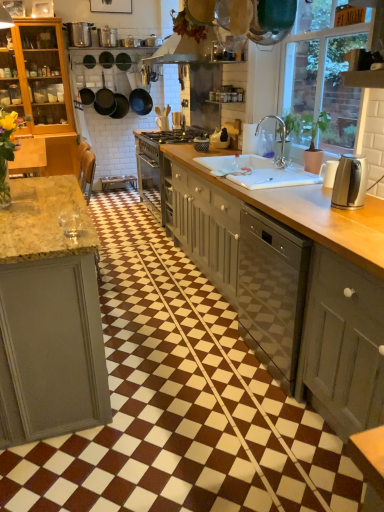
Question: Is matte black basket at center, which is the 2th appliance in front-to-back order, further to camera compared to satin silver toaster at center, which ranks as the fourth appliance in bottom-to-top order?

Choices:
 (A) no
 (B) yes

Answer: (A)

Question: Is matte black basket at center, which is the 4th appliance in back-to-front order, thinner than satin silver toaster at center, the first appliance in the back-to-front sequence?

Choices:
 (A) no
 (B) yes

Answer: (A)

Question: From the image's perspective, does matte black basket at center, which is the 4th appliance in back-to-front order, appear lower than satin silver toaster at center, the 4th appliance when ordered from right to left?

Choices:
 (A) no
 (B) yes

Answer: (B)

Question: Would you say satin silver toaster at center, the 4th appliance when ordered from right to left, is part of matte black basket at center, acting as the fourth appliance starting from the top,'s contents?

Choices:
 (A) no
 (B) yes

Answer: (A)

Question: Is matte black basket at center, which is the 2th appliance in front-to-back order, facing away from satin silver toaster at center, the first appliance in the back-to-front sequence?

Choices:
 (A) no
 (B) yes

Answer: (A)

Question: Relative to satin silver toaster at center, the first appliance in the back-to-front sequence, is matte black frying pan at upper left, the 1th frying pan from the left, in front or behind?

Choices:
 (A) behind
 (B) front

Answer: (A)

Question: Do you think matte black frying pan at upper left, the third frying pan positioned from the right, is within satin silver toaster at center, arranged as the 2th appliance when viewed from the top, or outside of it?

Choices:
 (A) inside
 (B) outside

Answer: (B)

Question: Considering the positions of matte black frying pan at upper left, the 1th frying pan from the left, and satin silver toaster at center, arranged as the 2th appliance when viewed from the top, in the image, is matte black frying pan at upper left, the 1th frying pan from the left, taller or shorter than satin silver toaster at center, arranged as the 2th appliance when viewed from the top,?

Choices:
 (A) tall
 (B) short

Answer: (A)

Question: Looking at their shapes, would you say matte black frying pan at upper left, the third frying pan positioned from the right, is wider or thinner than satin silver toaster at center, marked as the second appliance in a left-to-right arrangement?

Choices:
 (A) thin
 (B) wide

Answer: (B)

Question: In the image, is satin silver kettle at right on the left side or the right side of satin silver toaster at center, arranged as the 2th appliance when viewed from the top?

Choices:
 (A) left
 (B) right

Answer: (B)

Question: Relative to satin silver toaster at center, the first appliance in the back-to-front sequence, is satin silver kettle at right in front or behind?

Choices:
 (A) front
 (B) behind

Answer: (A)

Question: In terms of height, does satin silver kettle at right look taller or shorter compared to satin silver toaster at center, marked as the second appliance in a left-to-right arrangement?

Choices:
 (A) short
 (B) tall

Answer: (B)

Question: Looking at the image, does satin silver kettle at right seem bigger or smaller compared to satin silver toaster at center, the first appliance in the back-to-front sequence?

Choices:
 (A) small
 (B) big

Answer: (B)

Question: From a real-world perspective, relative to matte black kettle at upper center, the 2th appliance positioned from the right, is white glossy sink at center vertically above or below?

Choices:
 (A) below
 (B) above

Answer: (A)

Question: From their relative heights in the image, would you say white glossy sink at center is taller or shorter than matte black kettle at upper center, the 3th appliance viewed from the front?

Choices:
 (A) tall
 (B) short

Answer: (B)